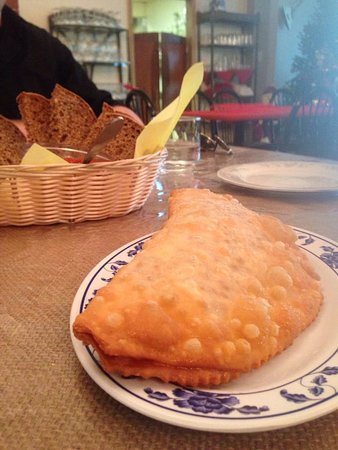
Where is `wall`? The image size is (338, 450). wall is located at coordinates (33, 8), (195, 9).